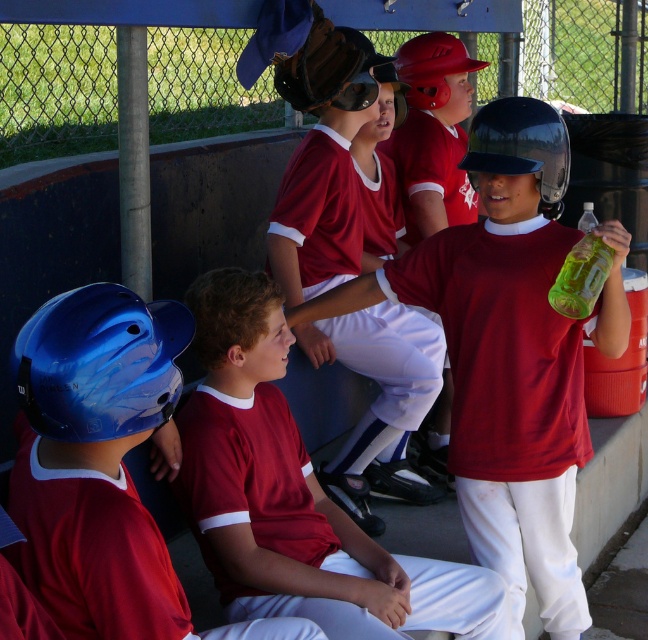
Question: Is shiny red helmet at center below brown leather glove at upper center?

Choices:
 (A) yes
 (B) no

Answer: (A)

Question: Which point is farther to the camera?

Choices:
 (A) shiny red helmet at center
 (B) brown leather glove at upper center

Answer: (B)

Question: Among these points, which one is farthest from the camera?

Choices:
 (A) (126, 474)
 (B) (548, 116)
 (C) (312, 13)

Answer: (C)

Question: Can you confirm if matte red baseball glove at center is smaller than brown leather glove at upper center?

Choices:
 (A) yes
 (B) no

Answer: (B)

Question: Where is shiny red helmet at center located in relation to brown leather glove at upper center in the image?

Choices:
 (A) left
 (B) right

Answer: (B)

Question: Which of the following is the farthest from the observer?

Choices:
 (A) (334, 49)
 (B) (165, 314)
 (C) (307, 312)

Answer: (A)